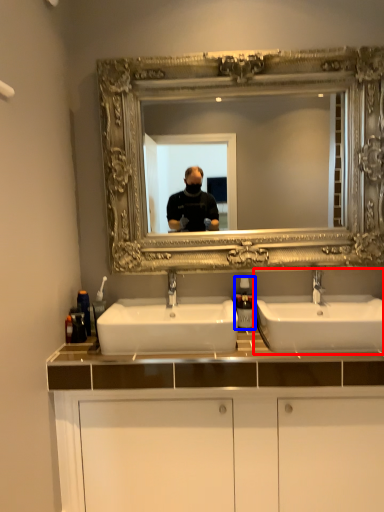
Question: Which object appears closest to the camera in this image, sink (highlighted by a red box) or soap dispenser (highlighted by a blue box)?

Choices:
 (A) sink
 (B) soap dispenser

Answer: (A)